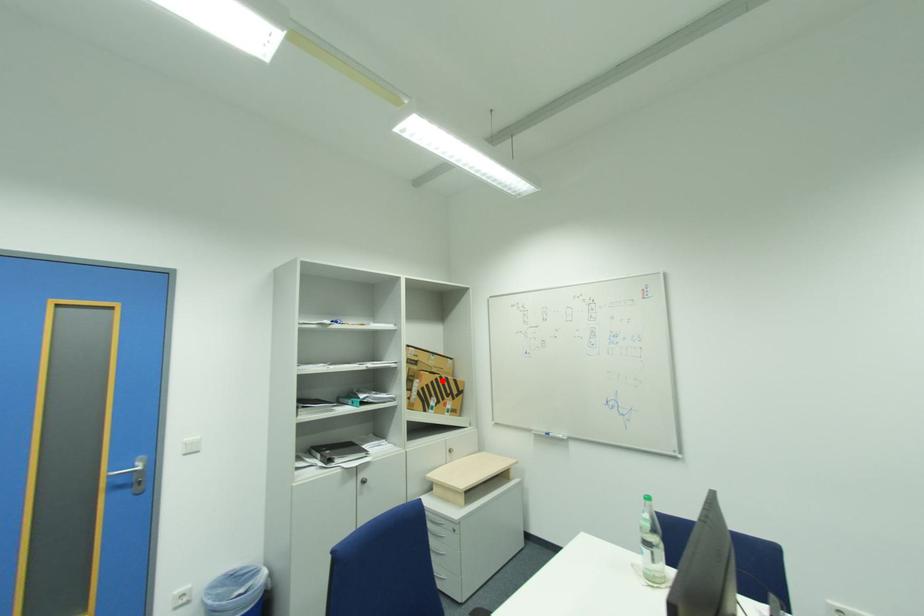
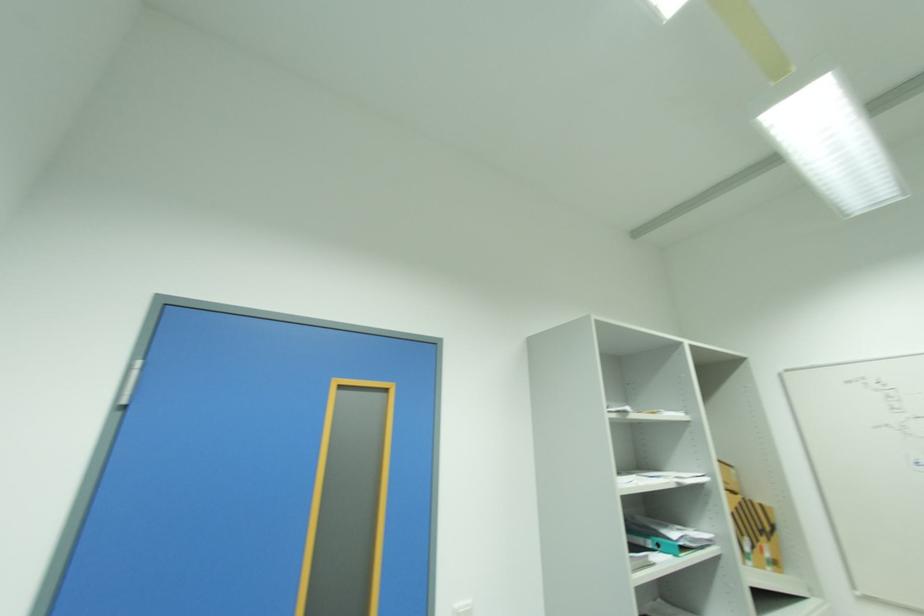
Question: I am providing you with two images of the same scene from different viewpoints. In image1, a red point is highlighted. Considering the same 3D point in image2, which of the following is correct?

Choices:
 (A) It is closer
 (B) It is farther

Answer: (A)